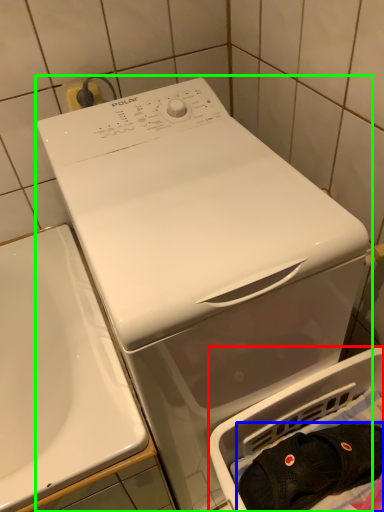
Question: Which is nearer to the dish washer (highlighted by a red box)? clothing (highlighted by a blue box) or washing machine (highlighted by a green box).

Choices:
 (A) clothing
 (B) washing machine

Answer: (A)